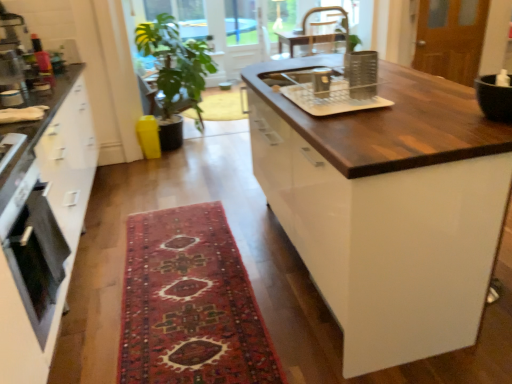
Question: From a real-world perspective, is green leafy plant at center beneath green leafy plant at upper center?

Choices:
 (A) no
 (B) yes

Answer: (B)

Question: Does green leafy plant at center have a lesser width compared to green leafy plant at upper center?

Choices:
 (A) yes
 (B) no

Answer: (B)

Question: Considering the relative sizes of green leafy plant at center and green leafy plant at upper center in the image provided, is green leafy plant at center bigger than green leafy plant at upper center?

Choices:
 (A) no
 (B) yes

Answer: (B)

Question: From the image's perspective, does green leafy plant at center appear lower than green leafy plant at upper center?

Choices:
 (A) no
 (B) yes

Answer: (B)

Question: Does green leafy plant at center have a greater width compared to green leafy plant at upper center?

Choices:
 (A) no
 (B) yes

Answer: (B)

Question: From the image's perspective, relative to green leafy plant at center, is black glossy bowl at upper right, the 1th appliance in the right-to-left sequence, above or below?

Choices:
 (A) above
 (B) below

Answer: (B)

Question: Is black glossy bowl at upper right, the 1th appliance in the right-to-left sequence, to the left or to the right of green leafy plant at center in the image?

Choices:
 (A) left
 (B) right

Answer: (B)

Question: In the image, is black glossy bowl at upper right, which is the fourth appliance in back-to-front order, positioned in front of or behind green leafy plant at center?

Choices:
 (A) front
 (B) behind

Answer: (A)

Question: From a real-world perspective, is black glossy bowl at upper right, the 1th appliance when ordered from front to back, physically located above or below green leafy plant at center?

Choices:
 (A) below
 (B) above

Answer: (B)

Question: Looking at their shapes, would you say dark wood countertop at center is wider or thinner than metallic silver toaster at left, arranged as the 1th appliance when viewed from the left?

Choices:
 (A) thin
 (B) wide

Answer: (B)

Question: From a real-world perspective, is dark wood countertop at center above or below metallic silver toaster at left, which is the 4th appliance in front-to-back order?

Choices:
 (A) below
 (B) above

Answer: (A)

Question: Is dark wood countertop at center to the left or to the right of metallic silver toaster at left, arranged as the 1th appliance when viewed from the left, in the image?

Choices:
 (A) left
 (B) right

Answer: (B)

Question: From the image's perspective, is dark wood countertop at center located above or below metallic silver toaster at left, arranged as the 1th appliance when viewed from the left?

Choices:
 (A) below
 (B) above

Answer: (A)

Question: From a real-world perspective, is clear plastic dish rack at center, positioned as the 3th appliance in back-to-front order, positioned above or below green leafy plant at center?

Choices:
 (A) above
 (B) below

Answer: (A)

Question: Would you say clear plastic dish rack at center, the third appliance positioned from the left, is to the left or to the right of green leafy plant at center in the picture?

Choices:
 (A) right
 (B) left

Answer: (A)